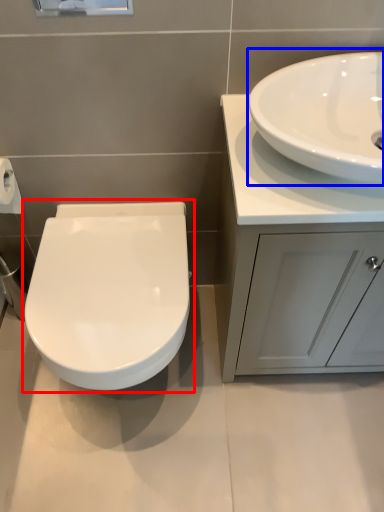
Question: Which point is further to the camera, toilet (highlighted by a red box) or sink (highlighted by a blue box)?

Choices:
 (A) toilet
 (B) sink

Answer: (A)